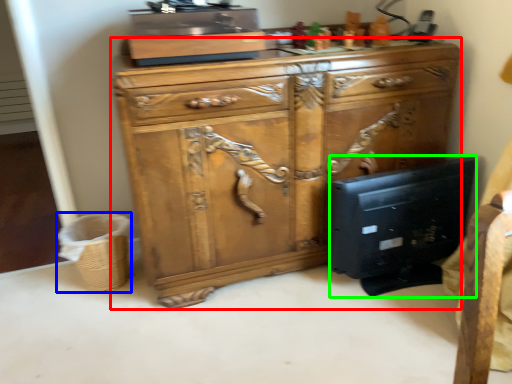
Question: Which object is the closest to the chest of drawers (highlighted by a red box)? Choose among these: basket (highlighted by a blue box) or desktop computer (highlighted by a green box).

Choices:
 (A) basket
 (B) desktop computer

Answer: (B)